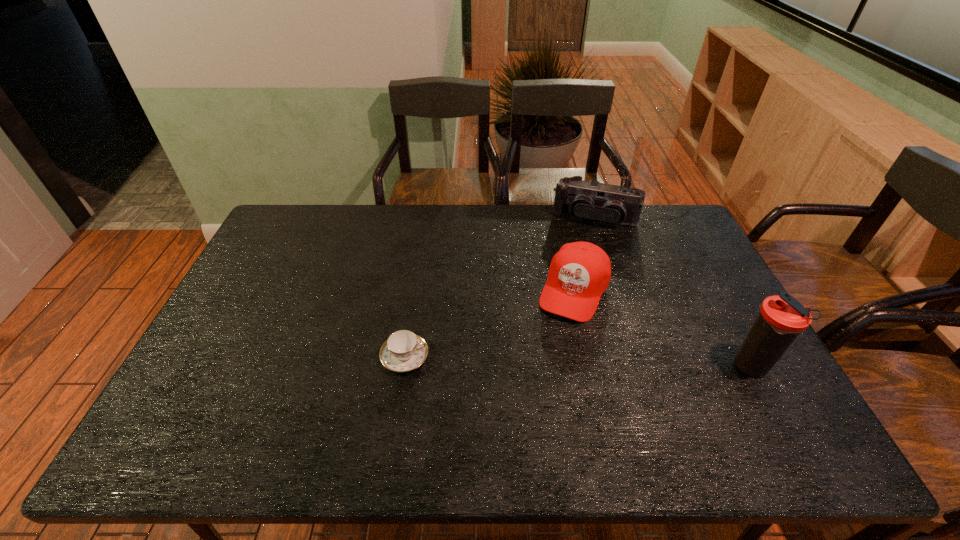
Where is `vacant space positioned 0.290m on the front panel of the second farthest object`? The width and height of the screenshot is (960, 540). vacant space positioned 0.290m on the front panel of the second farthest object is located at coordinates (526, 401).

Identify the location of vacant region located on the front-facing side of the camcorder. [x=569, y=283].

Find the location of a particular element. The image size is (960, 540). vacant area situated on the front-facing side of the camcorder is located at coordinates (576, 259).

Image resolution: width=960 pixels, height=540 pixels. Identify the location of vacant area located 0.210m on the front-facing side of the camcorder. click(x=573, y=269).

Find the location of `object present at the far edge`. object present at the far edge is located at coordinates (585, 200).

The image size is (960, 540). Find the location of `object that is at the near edge`. object that is at the near edge is located at coordinates (782, 318).

Locate an element on the screen. object that is at the right edge is located at coordinates (782, 318).

This screenshot has height=540, width=960. What are the coordinates of `object that is at the near right corner` in the screenshot? It's located at (x=782, y=318).

Identify the location of free spot at the far edge of the desktop. (475, 206).

Locate an element on the screen. This screenshot has height=540, width=960. vacant point at the near edge is located at coordinates (316, 395).